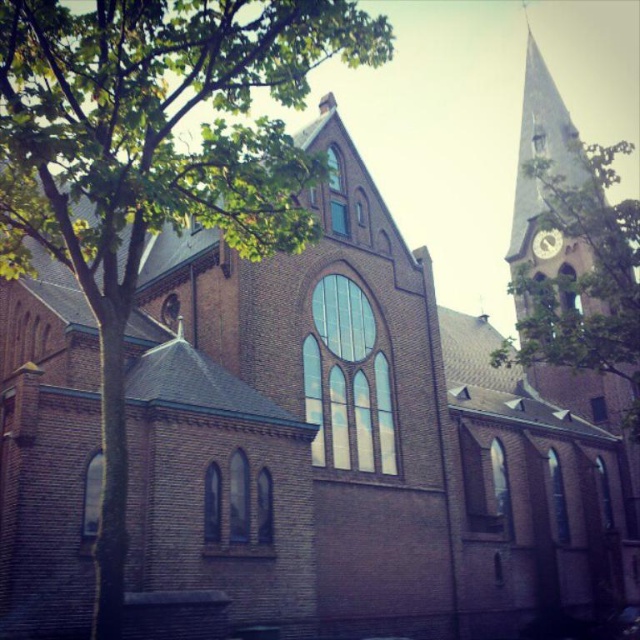
Which is more to the right, green leafy tree at left or metallic silver clock at upper right?

metallic silver clock at upper right

Which of these two, green leafy tree at left or metallic silver clock at upper right, stands shorter?

Standing shorter between the two is metallic silver clock at upper right.

Identify the location of green leafy tree at left. (154, 161).

Can you confirm if green leafy tree at left is positioned to the left of light pink stone clock tower at upper right?

Correct, you'll find green leafy tree at left to the left of light pink stone clock tower at upper right.

Does green leafy tree at left have a lesser width compared to light pink stone clock tower at upper right?

Yes, green leafy tree at left is thinner than light pink stone clock tower at upper right.

Is point (106, 19) less distant than point (588, 340)?

That is True.

I want to click on green leafy tree at left, so click(154, 161).

Measure the distance between light pink stone clock tower at upper right and metallic silver clock at upper right.

light pink stone clock tower at upper right is 53.69 feet away from metallic silver clock at upper right.

Which is more to the left, light pink stone clock tower at upper right or metallic silver clock at upper right?

From the viewer's perspective, metallic silver clock at upper right appears more on the left side.

Is point (627, 268) closer to camera compared to point (552, 253)?

Yes, it is.

The height and width of the screenshot is (640, 640). Find the location of `light pink stone clock tower at upper right`. light pink stone clock tower at upper right is located at coordinates (572, 250).